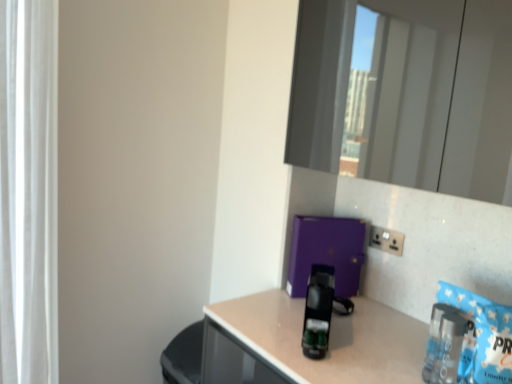
This screenshot has height=384, width=512. What are the coordinates of `clear plastic bottle at lower right` in the screenshot? It's located at (449, 348).

What do you see at coordinates (449, 348) in the screenshot? The image size is (512, 384). I see `clear plastic bottle at lower right` at bounding box center [449, 348].

I want to click on white plastic electric outlet at upper right, so click(x=387, y=240).

Between clear plastic bottle at lower right and white plastic electric outlet at upper right, which one is positioned behind?

white plastic electric outlet at upper right is behind.

Looking at this image, considering the positions of objects clear plastic bottle at lower right and white plastic electric outlet at upper right in the image provided, who is more to the right, clear plastic bottle at lower right or white plastic electric outlet at upper right?

From the viewer's perspective, white plastic electric outlet at upper right appears more on the right side.

Considering the sizes of objects clear plastic bottle at lower right and white plastic electric outlet at upper right in the image provided, who is bigger, clear plastic bottle at lower right or white plastic electric outlet at upper right?

clear plastic bottle at lower right.

Locate an element on the screen. The image size is (512, 384). bottle below the white plastic electric outlet at upper right (from the image's perspective) is located at coordinates (449, 348).

Is point (18, 292) positioned before point (322, 310)?

No, it is not.

Which of these two, white sheer curtain at left or black plastic coffee machine at center, stands shorter?

black plastic coffee machine at center is shorter.

Can you confirm if white sheer curtain at left is wider than black plastic coffee machine at center?

No.

Is white sheer curtain at left inside the boundaries of black plastic coffee machine at center, or outside?

white sheer curtain at left is not inside black plastic coffee machine at center, it's outside.

Considering the relative sizes of white plastic electric outlet at upper right and white sheer curtain at left in the image provided, is white plastic electric outlet at upper right smaller than white sheer curtain at left?

Indeed, white plastic electric outlet at upper right has a smaller size compared to white sheer curtain at left.

From the image's perspective, does white plastic electric outlet at upper right appear lower than white sheer curtain at left?

Indeed, from the image's perspective, white plastic electric outlet at upper right is shown beneath white sheer curtain at left.

Can you confirm if white plastic electric outlet at upper right is shorter than white sheer curtain at left?

Indeed, white plastic electric outlet at upper right has a lesser height compared to white sheer curtain at left.

Does white plastic electric outlet at upper right appear on the left side of white sheer curtain at left?

In fact, white plastic electric outlet at upper right is to the right of white sheer curtain at left.

From the picture: Is white plastic electric outlet at upper right inside or outside of clear plastic bottle at lower right?

white plastic electric outlet at upper right lies outside clear plastic bottle at lower right.

In terms of width, does white plastic electric outlet at upper right look wider or thinner when compared to clear plastic bottle at lower right?

Clearly, white plastic electric outlet at upper right has less width compared to clear plastic bottle at lower right.

Who is more distant, white plastic electric outlet at upper right or clear plastic bottle at lower right?

white plastic electric outlet at upper right is behind.

Can you confirm if black plastic coffee machine at center is taller than white sheer curtain at left?

No.

Looking at this image, based on their positions, is black plastic coffee machine at center located to the left or right of white sheer curtain at left?

Clearly, black plastic coffee machine at center is on the right of white sheer curtain at left in the image.

Could you tell me if black plastic coffee machine at center is facing white sheer curtain at left?

No, black plastic coffee machine at center is not aimed at white sheer curtain at left.

From a real-world perspective, who is located lower, black plastic coffee machine at center or white sheer curtain at left?

From a 3D spatial view, black plastic coffee machine at center is below.

From the image's perspective, does white sheer curtain at left appear lower than white plastic electric outlet at upper right?

No.

Which is closer to the camera, [42,275] or [375,247]?

Positioned in front is point [375,247].

Does white sheer curtain at left have a lesser width compared to white plastic electric outlet at upper right?

In fact, white sheer curtain at left might be wider than white plastic electric outlet at upper right.

Does white sheer curtain at left touch white plastic electric outlet at upper right?

They are not placed beside each other.

Would you say black plastic coffee machine at center is inside or outside clear plastic bottle at lower right?

black plastic coffee machine at center lies outside clear plastic bottle at lower right.

Is black plastic coffee machine at center oriented away from clear plastic bottle at lower right?

black plastic coffee machine at center is not turned away from clear plastic bottle at lower right.

Is black plastic coffee machine at center far from clear plastic bottle at lower right?

That's not correct — black plastic coffee machine at center is a little close to clear plastic bottle at lower right.

Locate an element on the screen. Image resolution: width=512 pixels, height=384 pixels. bottle that appears below the black plastic coffee machine at center (from the image's perspective) is located at coordinates (449, 348).

The image size is (512, 384). In the image, there is a white plastic electric outlet at upper right. Identify the location of bottle below it (from the image's perspective). (449, 348).

I want to click on curtain on the left of the black plastic coffee machine at center, so click(28, 191).

From the image, which object appears to be farther from white sheer curtain at left, black plastic coffee machine at center or clear plastic bottle at lower right?

clear plastic bottle at lower right lies further to white sheer curtain at left than the other object.

Which object lies further to the anchor point clear plastic bottle at lower right, white sheer curtain at left or white plastic electric outlet at upper right?

white sheer curtain at left is further to clear plastic bottle at lower right.

Estimate the real-world distances between objects in this image. Which object is further from black plastic coffee machine at center, white sheer curtain at left or white plastic electric outlet at upper right?

white sheer curtain at left is further to black plastic coffee machine at center.

Considering their positions, is white plastic electric outlet at upper right positioned closer to black plastic coffee machine at center than white sheer curtain at left?

Based on the image, white plastic electric outlet at upper right appears to be nearer to black plastic coffee machine at center.

Which object lies further to the anchor point white plastic electric outlet at upper right, white sheer curtain at left or clear plastic bottle at lower right?

white sheer curtain at left is further to white plastic electric outlet at upper right.

From the image, which object appears to be nearer to clear plastic bottle at lower right, black plastic coffee machine at center or white plastic electric outlet at upper right?

Among the two, black plastic coffee machine at center is located nearer to clear plastic bottle at lower right.

Looking at the image, which one is located closer to white sheer curtain at left, black plastic coffee machine at center or white plastic electric outlet at upper right?

Among the two, black plastic coffee machine at center is located nearer to white sheer curtain at left.

Estimate the real-world distances between objects in this image. Which object is closer to white sheer curtain at left, clear plastic bottle at lower right or white plastic electric outlet at upper right?

white plastic electric outlet at upper right is closer to white sheer curtain at left.

Where is `appliance positioned between clear plastic bottle at lower right and white plastic electric outlet at upper right from near to far`? The width and height of the screenshot is (512, 384). appliance positioned between clear plastic bottle at lower right and white plastic electric outlet at upper right from near to far is located at coordinates (318, 311).

You are a GUI agent. You are given a task and a screenshot of the screen. Output one action in this format:
    pyautogui.click(x=<x>, y=<y>)
    Task: Click on the appliance located between white sheer curtain at left and white plastic electric outlet at upper right in the left-right direction
    The height and width of the screenshot is (384, 512).
    Given the screenshot: What is the action you would take?
    pyautogui.click(x=318, y=311)

Locate an element on the screen. The height and width of the screenshot is (384, 512). appliance situated between white sheer curtain at left and clear plastic bottle at lower right from left to right is located at coordinates (318, 311).

You are a GUI agent. You are given a task and a screenshot of the screen. Output one action in this format:
    pyautogui.click(x=<x>, y=<y>)
    Task: Click on the bottle between white sheer curtain at left and white plastic electric outlet at upper right from left to right
    This screenshot has width=512, height=384.
    Given the screenshot: What is the action you would take?
    pyautogui.click(x=449, y=348)